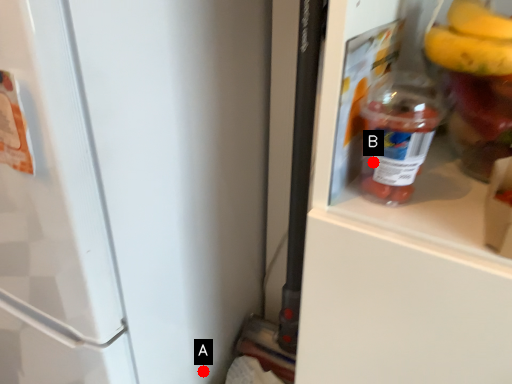
Question: Two points are circled on the image, labeled by A and B beside each circle. Which point is farther to the camera?

Choices:
 (A) A is further
 (B) B is further

Answer: (A)